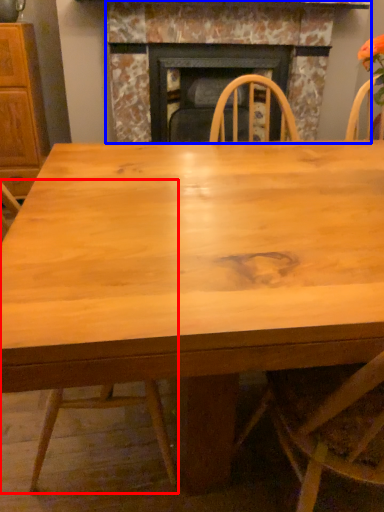
Question: Which object appears closest to the camera in this image, chair (highlighted by a red box) or fireplace (highlighted by a blue box)?

Choices:
 (A) chair
 (B) fireplace

Answer: (A)